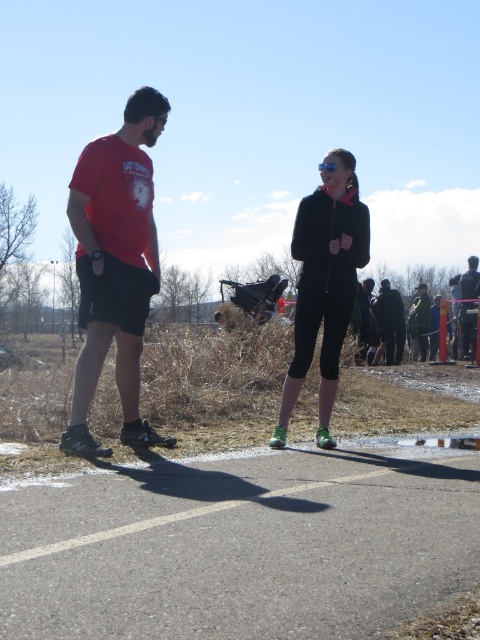
Does black fleece jacket at center appear on the left side of khaki cotton jacket at center?

Indeed, black fleece jacket at center is positioned on the left side of khaki cotton jacket at center.

Which is more to the left, black fleece jacket at center or khaki cotton jacket at center?

From the viewer's perspective, black fleece jacket at center appears more on the left side.

Which is behind, point (324, 204) or point (409, 332)?

Point (409, 332)

Locate an element on the screen. This screenshot has width=480, height=640. black fleece jacket at center is located at coordinates (324, 284).

This screenshot has width=480, height=640. In order to click on black matte jacket at center in this screenshot , I will do coord(388,323).

Does black matte jacket at center appear on the left side of khaki cotton jacket at center?

Yes, black matte jacket at center is to the left of khaki cotton jacket at center.

The image size is (480, 640). Describe the element at coordinates (388, 323) in the screenshot. I see `black matte jacket at center` at that location.

Image resolution: width=480 pixels, height=640 pixels. I want to click on black matte jacket at center, so click(x=388, y=323).

Is khaki cotton jacket at center thinner than matte black shorts at center?

In fact, khaki cotton jacket at center might be wider than matte black shorts at center.

Image resolution: width=480 pixels, height=640 pixels. I want to click on khaki cotton jacket at center, so click(x=420, y=323).

You are a GUI agent. You are given a task and a screenshot of the screen. Output one action in this format:
    pyautogui.click(x=<x>, y=<y>)
    Task: Click on the khaki cotton jacket at center
    This screenshot has height=640, width=480.
    Given the screenshot: What is the action you would take?
    pyautogui.click(x=420, y=323)